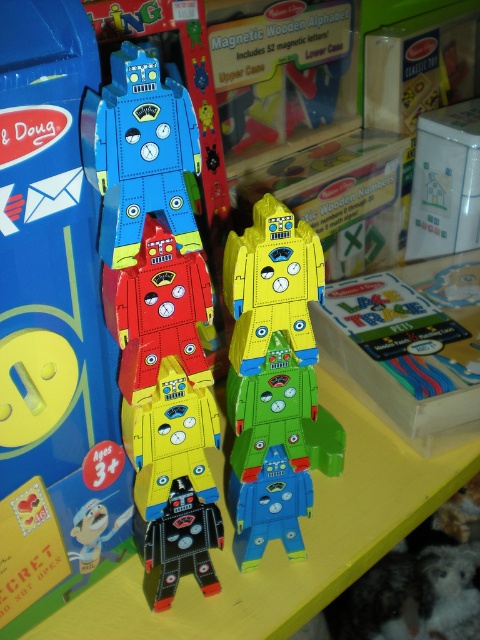
You are looking at the shelf with the yellow matte robot at center and the shiny black robot at center. Which robot is positioned to the right of the other?

The yellow matte robot at center is positioned to the right of the shiny black robot at center.